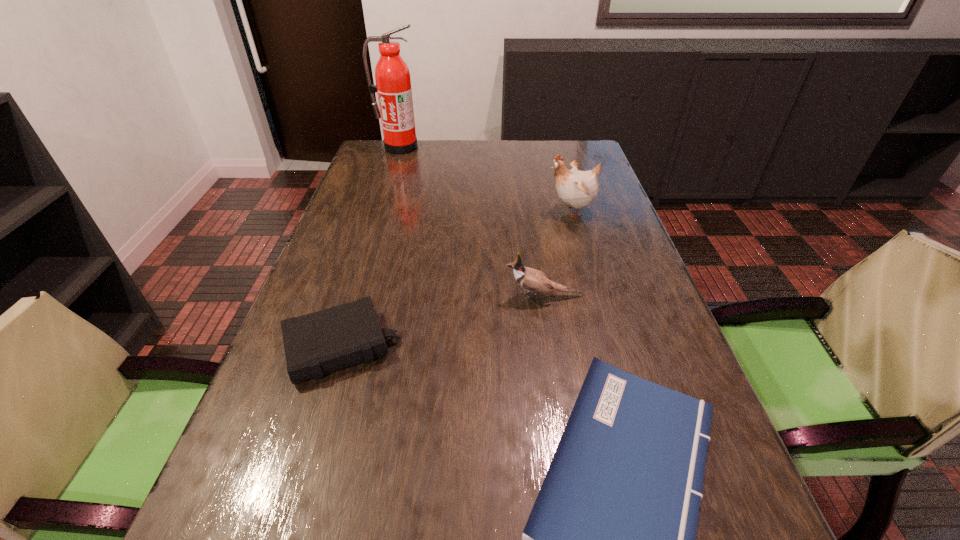
I want to click on vacant space at the far edge of the desktop, so click(x=480, y=168).

Where is `free space at the left edge`? Image resolution: width=960 pixels, height=540 pixels. free space at the left edge is located at coordinates (364, 195).

Locate an element on the screen. The height and width of the screenshot is (540, 960). vacant space at the right edge of the desktop is located at coordinates (590, 301).

This screenshot has height=540, width=960. Find the location of `vacant area at the far left corner of the desktop`. vacant area at the far left corner of the desktop is located at coordinates (366, 161).

Locate an element on the screen. The height and width of the screenshot is (540, 960). vacant area that lies between the Bible and the farther bird is located at coordinates (456, 279).

In order to click on free space between the farther bird and the nearer bird in this screenshot , I will do `click(558, 253)`.

The height and width of the screenshot is (540, 960). What are the coordinates of `empty location between the third tallest object and the tallest object` in the screenshot? It's located at (471, 221).

I want to click on free space between the nearer bird and the fourth tallest object, so click(442, 321).

Image resolution: width=960 pixels, height=540 pixels. I want to click on blank region between the fire extinguisher and the shorter bird, so click(471, 221).

I want to click on vacant area that lies between the farthest object and the farther bird, so click(x=486, y=179).